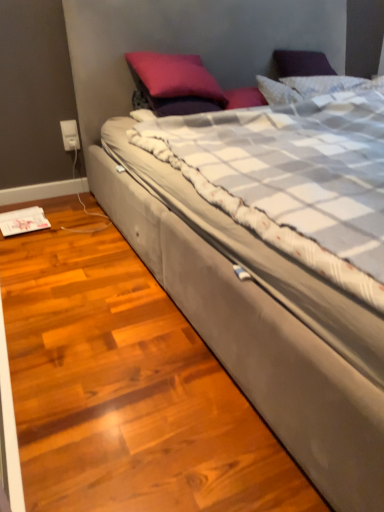
Question: Is satin purple pillow at upper center to the left of white plastic electric outlet at lower left from the viewer's perspective?

Choices:
 (A) yes
 (B) no

Answer: (B)

Question: Is the depth of satin purple pillow at upper center less than that of white plastic electric outlet at lower left?

Choices:
 (A) no
 (B) yes

Answer: (B)

Question: From a real-world perspective, is satin purple pillow at upper center located beneath white plastic electric outlet at lower left?

Choices:
 (A) no
 (B) yes

Answer: (A)

Question: Is satin purple pillow at upper center smaller than white plastic electric outlet at lower left?

Choices:
 (A) no
 (B) yes

Answer: (A)

Question: Is satin purple pillow at upper center not near white plastic electric outlet at lower left?

Choices:
 (A) yes
 (B) no

Answer: (B)

Question: Is satin purple pillow at upper center looking in the opposite direction of white plastic electric outlet at lower left?

Choices:
 (A) no
 (B) yes

Answer: (A)

Question: Is suede bed at center at the left side of white plastic electric outlet at lower left?

Choices:
 (A) no
 (B) yes

Answer: (A)

Question: From the image's perspective, is suede bed at center below white plastic electric outlet at lower left?

Choices:
 (A) yes
 (B) no

Answer: (A)

Question: Does suede bed at center have a greater height compared to white plastic electric outlet at lower left?

Choices:
 (A) no
 (B) yes

Answer: (B)

Question: Can white plastic electric outlet at lower left be found inside suede bed at center?

Choices:
 (A) no
 (B) yes

Answer: (A)

Question: From a real-world perspective, is suede bed at center below white plastic electric outlet at lower left?

Choices:
 (A) no
 (B) yes

Answer: (A)

Question: Considering the relative sizes of suede bed at center and white plastic electric outlet at lower left in the image provided, is suede bed at center shorter than white plastic electric outlet at lower left?

Choices:
 (A) yes
 (B) no

Answer: (B)

Question: Does suede bed at center come behind satin purple pillow at upper center?

Choices:
 (A) yes
 (B) no

Answer: (B)